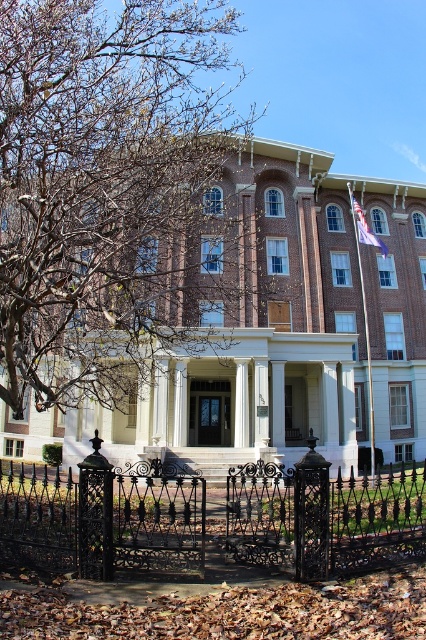
Is point (46, 262) farther from viewer compared to point (354, 224)?

No, it is not.

Who is more distant from viewer, (88, 189) or (380, 252)?

The point (380, 252) is more distant.

Locate an element on the screen. The height and width of the screenshot is (640, 426). brown leafy tree at upper left is located at coordinates tap(111, 195).

Is black wrought iron gate at lower center bigger than white fabric flag at upper right?

Yes, black wrought iron gate at lower center is bigger than white fabric flag at upper right.

Is black wrought iron gate at lower center positioned before white fabric flag at upper right?

Yes, it is in front of white fabric flag at upper right.

You are a GUI agent. You are given a task and a screenshot of the screen. Output one action in this format:
    pyautogui.click(x=<x>, y=<y>)
    Task: Click on the black wrought iron gate at lower center
    The height and width of the screenshot is (640, 426).
    Given the screenshot: What is the action you would take?
    pyautogui.click(x=101, y=518)

You are a GUI agent. You are given a task and a screenshot of the screen. Output one action in this format:
    pyautogui.click(x=<x>, y=<y>)
    Task: Click on the black wrought iron gate at lower center
    The height and width of the screenshot is (640, 426).
    Given the screenshot: What is the action you would take?
    [101, 518]

Between brown leafy tree at upper left and black wrought iron gate at lower center, which one appears on the left side from the viewer's perspective?

brown leafy tree at upper left is more to the left.

Measure the distance between point (20, 417) and camera.

Point (20, 417) is 62.34 meters away from camera.

Find the location of a particular element. Image resolution: width=426 pixels, height=640 pixels. brown leafy tree at upper left is located at coordinates (111, 195).